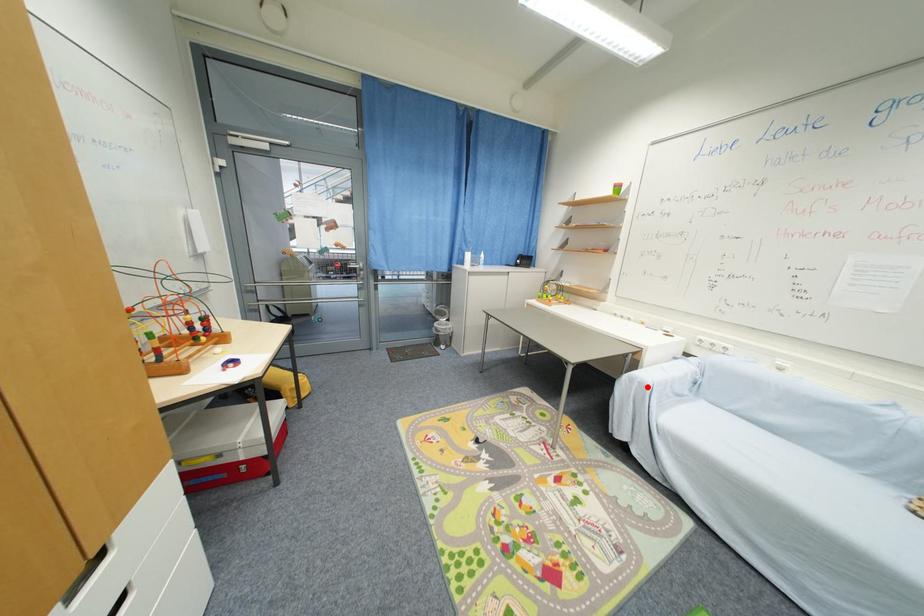
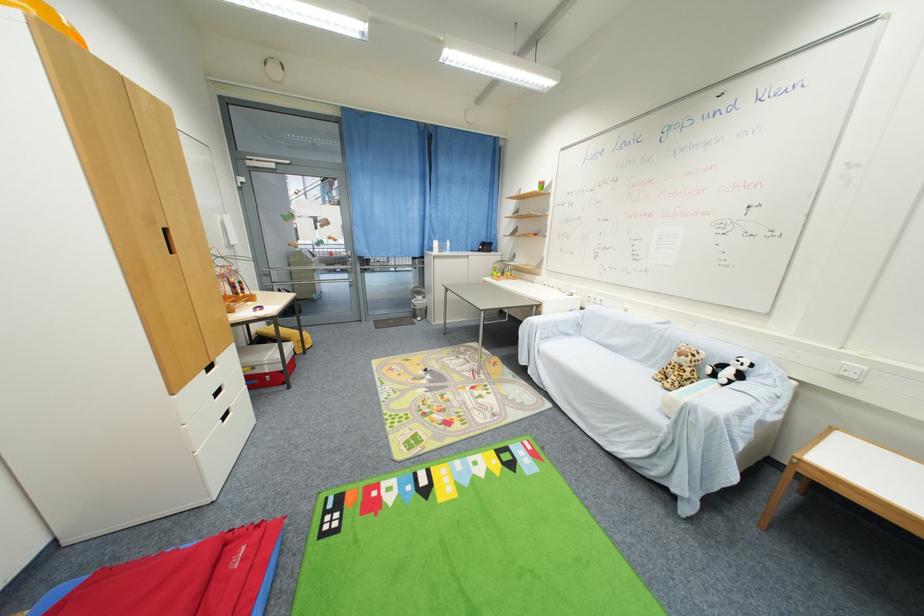
Question: I am providing you with two images of the same scene from different viewpoints. A red point is shown in image1. For the corresponding object point in image2, is it positioned nearer or farther from the camera?

Choices:
 (A) Nearer
 (B) Farther

Answer: (A)